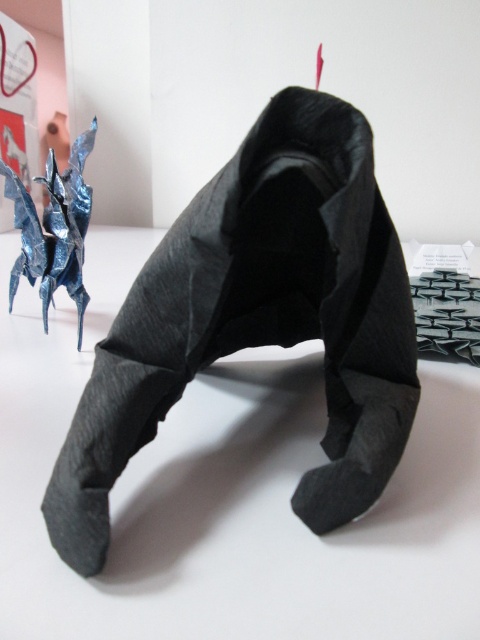
This screenshot has height=640, width=480. What do you see at coordinates (259, 317) in the screenshot? I see `black paper sculpture at center` at bounding box center [259, 317].

Can you confirm if black paper sculpture at center is positioned below metallic blue origami dragon at upper left?

Yes, black paper sculpture at center is below metallic blue origami dragon at upper left.

Where is `black paper sculpture at center`? The height and width of the screenshot is (640, 480). black paper sculpture at center is located at coordinates (259, 317).